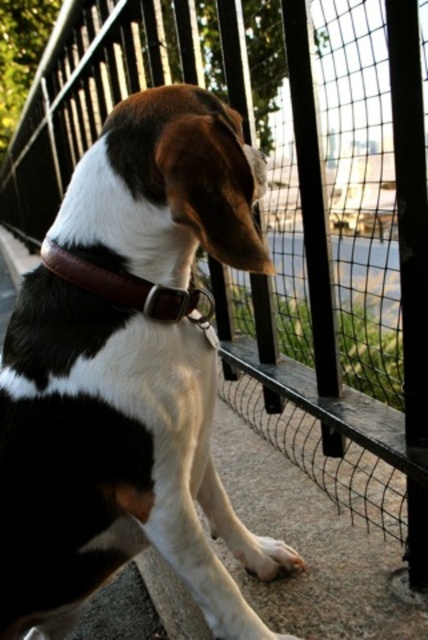
You are a photographer trying to capture the dog in the image. You want to focus on the black and white fur at center without the brown leather collar at center blocking the view. Is the collar currently in a position that might obstruct your shot?

The black and white fur at center is positioned under the brown leather collar at center, so the collar is likely obstructing the view of the fur. To avoid this, you might need to adjust the angle or position to ensure the collar doesn not block the fur.